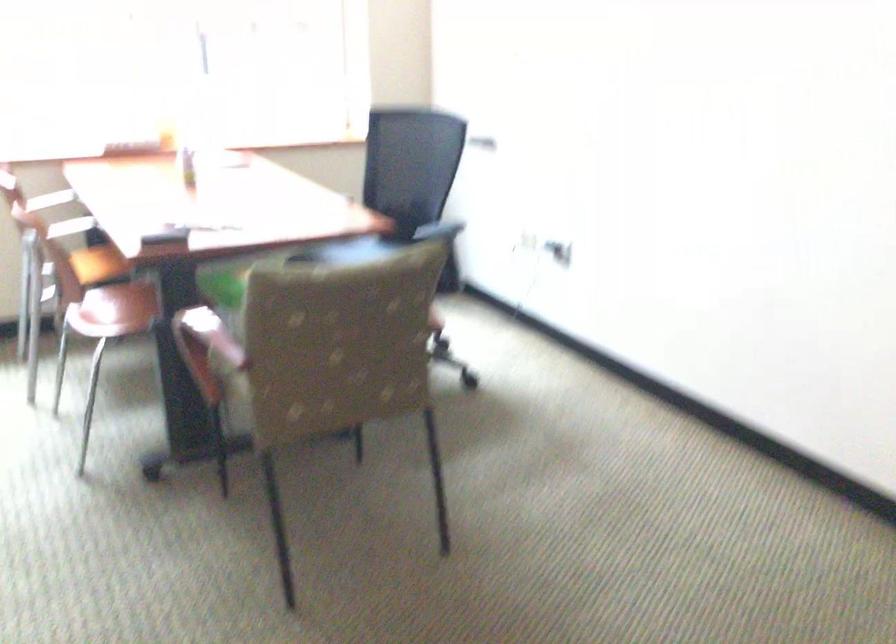
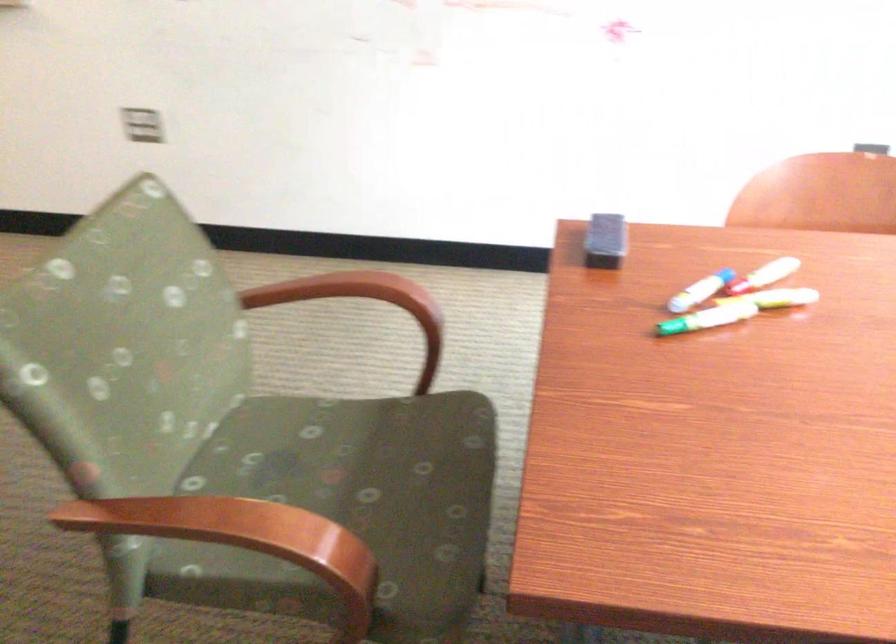
Locate, in the second image, the point that corresponds to point 197,216 in the first image.

(700, 290)